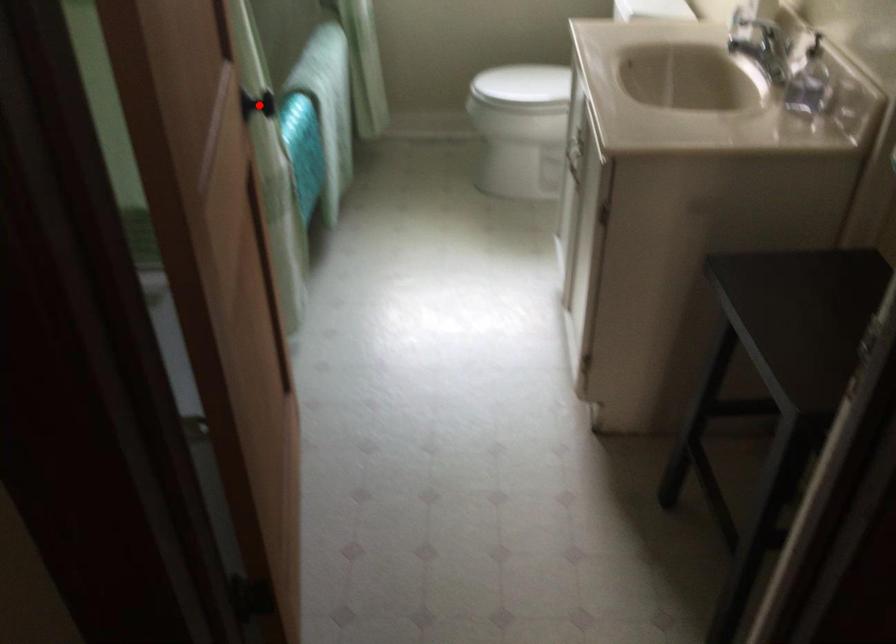
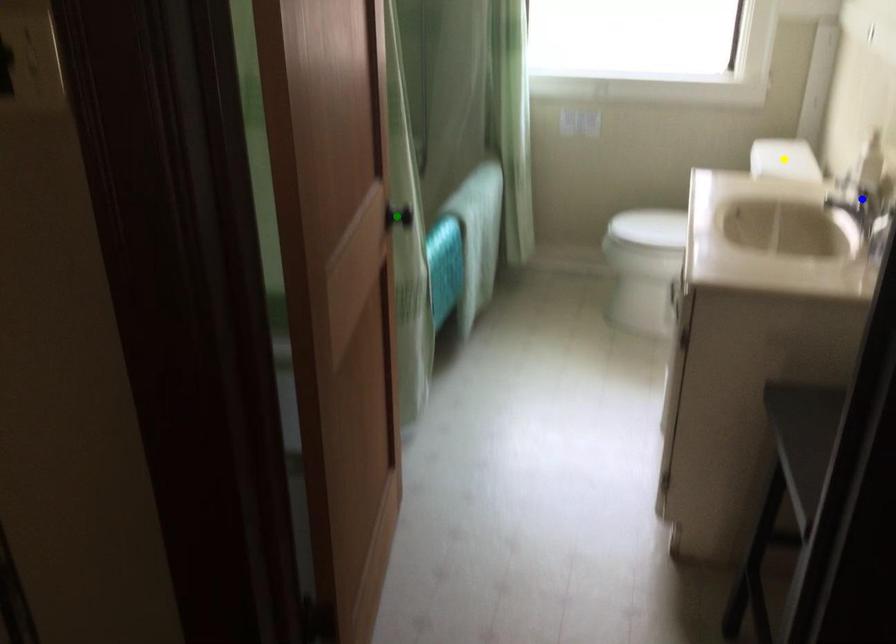
Question: I am providing you with two images of the same scene from different viewpoints. A red point is marked on the first image. You are given multiple points on the second image. Which mark in image 2 goes with the point in image 1?

Choices:
 (A) green point
 (B) blue point
 (C) yellow point

Answer: (A)